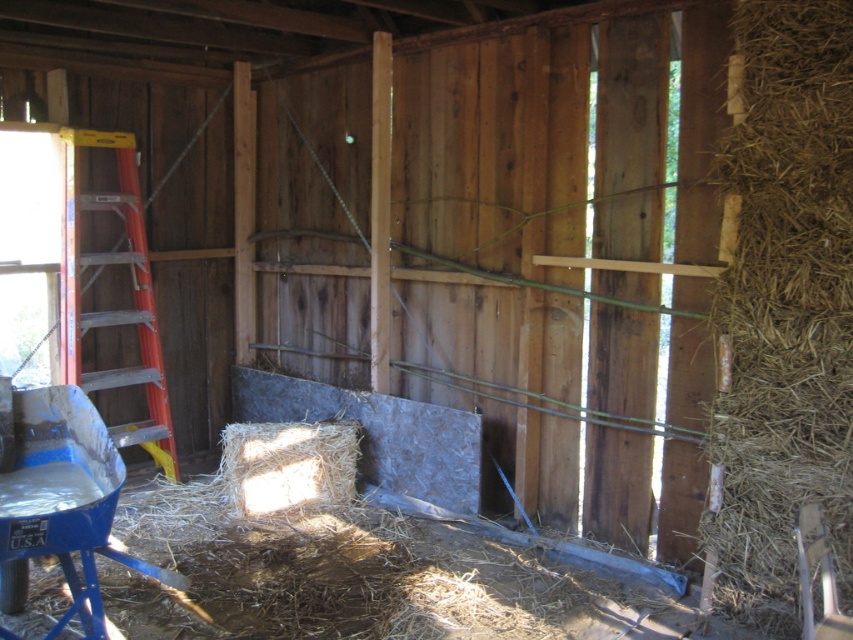
Which of these two, brown straw at right or orange aluminum ladder at left, stands taller?

With more height is brown straw at right.

Is brown straw at right to the left of orange aluminum ladder at left from the viewer's perspective?

Incorrect, brown straw at right is not on the left side of orange aluminum ladder at left.

Does point (758, 164) come behind point (160, 353)?

No.

The height and width of the screenshot is (640, 853). Find the location of `brown straw at right`. brown straw at right is located at coordinates (786, 308).